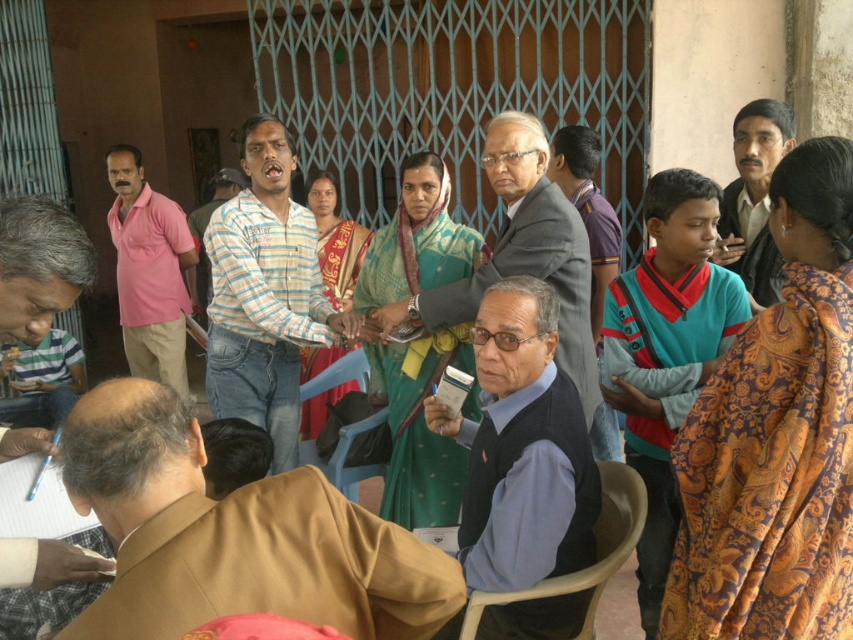
Question: Can you confirm if matte gray vest at center is positioned above matte black shirt at upper right?

Choices:
 (A) yes
 (B) no

Answer: (B)

Question: Is brown fabric jacket at lower left bigger than pink cotton shirt at left?

Choices:
 (A) no
 (B) yes

Answer: (A)

Question: Observing the image, what is the correct spatial positioning of dark blue fabric vest at center in reference to pink cotton shirt at left?

Choices:
 (A) left
 (B) right

Answer: (B)

Question: Which object appears closest to the camera in this image?

Choices:
 (A) pink cotton shirt at left
 (B) matte black shirt at upper right
 (C) brown fabric jacket at lower left
 (D) matte gray vest at center

Answer: (C)

Question: Which object is the closest to the pink cotton shirt at left?

Choices:
 (A) matte gray vest at center
 (B) striped cotton shirt at center
 (C) brown fabric jacket at lower left

Answer: (B)

Question: Considering the real-world distances, which object is closest to the dark blue fabric vest at center?

Choices:
 (A) pink cotton shirt at left
 (B) matte gray vest at center

Answer: (B)